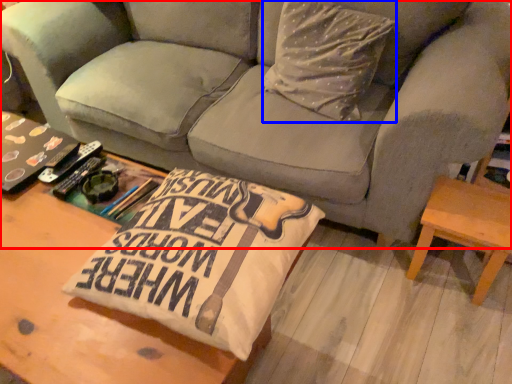
Question: Which object appears farthest to the camera in this image, studio couch (highlighted by a red box) or throw pillow (highlighted by a blue box)?

Choices:
 (A) studio couch
 (B) throw pillow

Answer: (B)